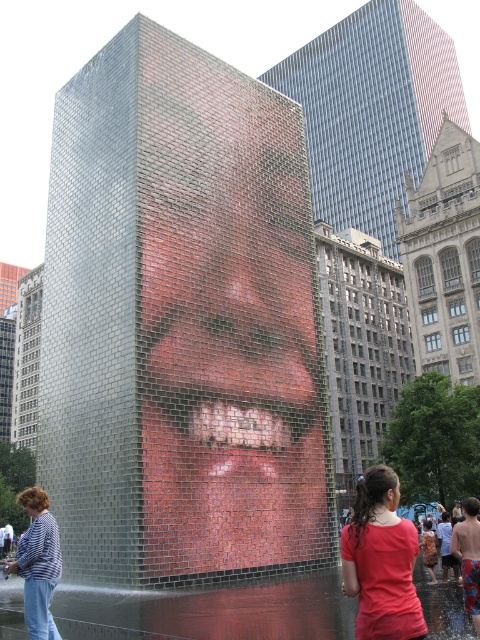
Looking at this image, which of these two, metallic mosaic face at center or striped fabric shirt at lower left, stands taller?

metallic mosaic face at center

Can you confirm if metallic mosaic face at center is smaller than striped fabric shirt at lower left?

Actually, metallic mosaic face at center might be larger than striped fabric shirt at lower left.

Identify the location of metallic mosaic face at center. The width and height of the screenshot is (480, 640). (229, 346).

The width and height of the screenshot is (480, 640). Identify the location of metallic mosaic face at center. (229, 346).

Does metallic mosaic face at center have a smaller size compared to orange printed dress at lower center?

No, metallic mosaic face at center is not smaller than orange printed dress at lower center.

This screenshot has height=640, width=480. I want to click on metallic mosaic face at center, so click(x=229, y=346).

Find the location of a particular element. The image size is (480, 640). metallic mosaic face at center is located at coordinates (229, 346).

This screenshot has width=480, height=640. Describe the element at coordinates (381, 561) in the screenshot. I see `matte red shirt at lower right` at that location.

Is matte red shirt at lower right wider than orange printed dress at lower center?

No, matte red shirt at lower right is not wider than orange printed dress at lower center.

Locate an element on the screen. Image resolution: width=480 pixels, height=640 pixels. matte red shirt at lower right is located at coordinates (381, 561).